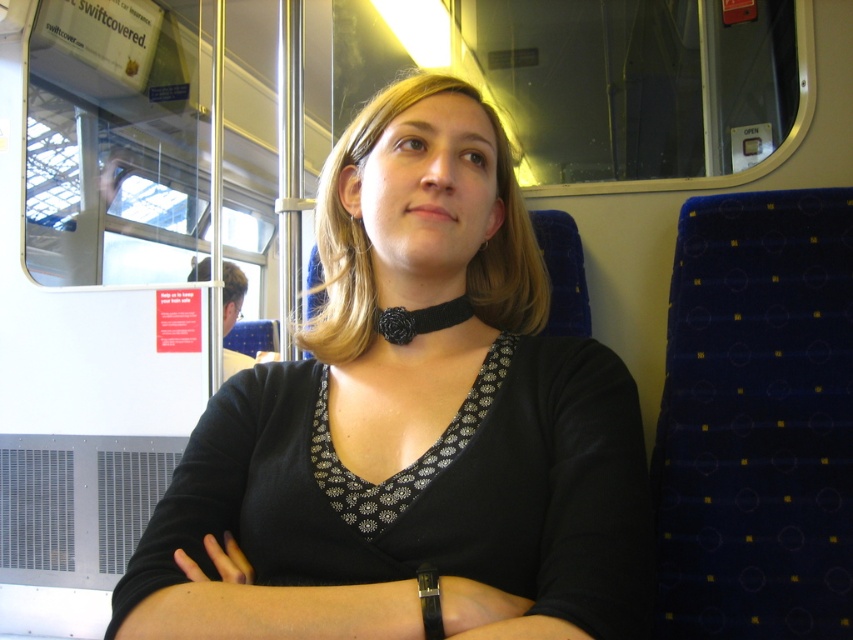
Does black matte choker at center lie in front of black fabric neckband at center?

Yes.

Does point (231, 500) lie behind point (460, 310)?

No, it is not.

The width and height of the screenshot is (853, 640). Find the location of `black matte choker at center`. black matte choker at center is located at coordinates (410, 428).